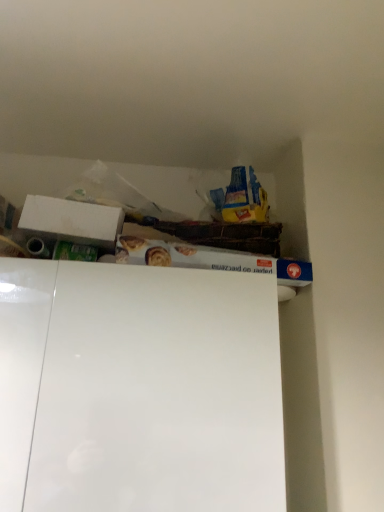
This screenshot has height=512, width=384. In order to click on white cardboard box at upper left in this screenshot , I will do `click(71, 221)`.

What do you see at coordinates (71, 221) in the screenshot? I see `white cardboard box at upper left` at bounding box center [71, 221].

Locate an element on the screen. Image resolution: width=384 pixels, height=512 pixels. white glossy cabinet at upper center is located at coordinates (139, 389).

What do you see at coordinates (139, 389) in the screenshot? I see `white glossy cabinet at upper center` at bounding box center [139, 389].

Find the location of `white cardboard box at upper left`. white cardboard box at upper left is located at coordinates (71, 221).

Considering the relative positions of white glossy cabinet at upper center and white cardboard box at upper left in the image provided, is white glossy cabinet at upper center to the left of white cardboard box at upper left from the viewer's perspective?

In fact, white glossy cabinet at upper center is to the right of white cardboard box at upper left.

Is white glossy cabinet at upper center positioned behind white cardboard box at upper left?

No, it is in front of white cardboard box at upper left.

Does point (160, 293) come behind point (96, 215)?

No, it is in front of (96, 215).

From the image's perspective, which one is positioned higher, white glossy cabinet at upper center or white cardboard box at upper left?

white cardboard box at upper left.

From a real-world perspective, between white glossy cabinet at upper center and white cardboard box at upper left, who is vertically higher?

In real-world perspective, white cardboard box at upper left is above.

In the scene shown: Considering the sizes of white glossy cabinet at upper center and white cardboard box at upper left in the image, is white glossy cabinet at upper center wider or thinner than white cardboard box at upper left?

white glossy cabinet at upper center is wider than white cardboard box at upper left.

Does white glossy cabinet at upper center have a greater height compared to white cardboard box at upper left?

Correct, white glossy cabinet at upper center is much taller as white cardboard box at upper left.

Looking at this image, can you confirm if white glossy cabinet at upper center is smaller than white cardboard box at upper left?

Incorrect, white glossy cabinet at upper center is not smaller in size than white cardboard box at upper left.

Is white glossy cabinet at upper center surrounding white cardboard box at upper left?

No, white cardboard box at upper left is not surrounded by white glossy cabinet at upper center.

Is there a large distance between white glossy cabinet at upper center and white cardboard box at upper left?

No, there isn't a large distance between white glossy cabinet at upper center and white cardboard box at upper left.

Is white glossy cabinet at upper center looking in the opposite direction of white cardboard box at upper left?

No.

How many degrees apart are the facing directions of white glossy cabinet at upper center and white cardboard box at upper left?

The facing directions of white glossy cabinet at upper center and white cardboard box at upper left are 92.2 degrees apart.

You are a GUI agent. You are given a task and a screenshot of the screen. Output one action in this format:
    pyautogui.click(x=<x>, y=<y>)
    Task: Click on the cabinet below the white cardboard box at upper left (from a real-world perspective)
    The image size is (384, 512).
    Given the screenshot: What is the action you would take?
    pyautogui.click(x=139, y=389)

Considering the positions of objects white cardboard box at upper left and white glossy cabinet at upper center in the image provided, who is more to the left, white cardboard box at upper left or white glossy cabinet at upper center?

white cardboard box at upper left is more to the left.

In the scene shown: Does white cardboard box at upper left come behind white glossy cabinet at upper center?

Yes.

In the scene shown: Which point is more distant from viewer, (79, 243) or (230, 434)?

The point (79, 243) is farther from the camera.

From the image's perspective, between white cardboard box at upper left and white glossy cabinet at upper center, who is located below?

white glossy cabinet at upper center appears lower in the image.

From a real-world perspective, is white cardboard box at upper left positioned above or below white glossy cabinet at upper center?

From a real-world perspective, white cardboard box at upper left is physically above white glossy cabinet at upper center.

Considering the sizes of white cardboard box at upper left and white glossy cabinet at upper center in the image, is white cardboard box at upper left wider or thinner than white glossy cabinet at upper center?

white cardboard box at upper left is thinner than white glossy cabinet at upper center.

Can you confirm if white cardboard box at upper left is shorter than white glossy cabinet at upper center?

Indeed, white cardboard box at upper left has a lesser height compared to white glossy cabinet at upper center.

In terms of size, does white cardboard box at upper left appear bigger or smaller than white glossy cabinet at upper center?

Clearly, white cardboard box at upper left is smaller in size than white glossy cabinet at upper center.

Is white cardboard box at upper left positioned beyond the bounds of white glossy cabinet at upper center?

Absolutely, white cardboard box at upper left is external to white glossy cabinet at upper center.

Are white cardboard box at upper left and white glossy cabinet at upper center far apart?

That's not correct — white cardboard box at upper left is a little close to white glossy cabinet at upper center.

Looking at this image, is white cardboard box at upper left looking in the opposite direction of white glossy cabinet at upper center?

No, white cardboard box at upper left is not facing the opposite direction of white glossy cabinet at upper center.

This screenshot has width=384, height=512. What are the coordinates of `cabinet that is in front of the white cardboard box at upper left` in the screenshot? It's located at (139, 389).

Image resolution: width=384 pixels, height=512 pixels. I want to click on box behind the white glossy cabinet at upper center, so tap(71, 221).

Where is `cabinet below the white cardboard box at upper left (from a real-world perspective)`? Image resolution: width=384 pixels, height=512 pixels. cabinet below the white cardboard box at upper left (from a real-world perspective) is located at coordinates (139, 389).